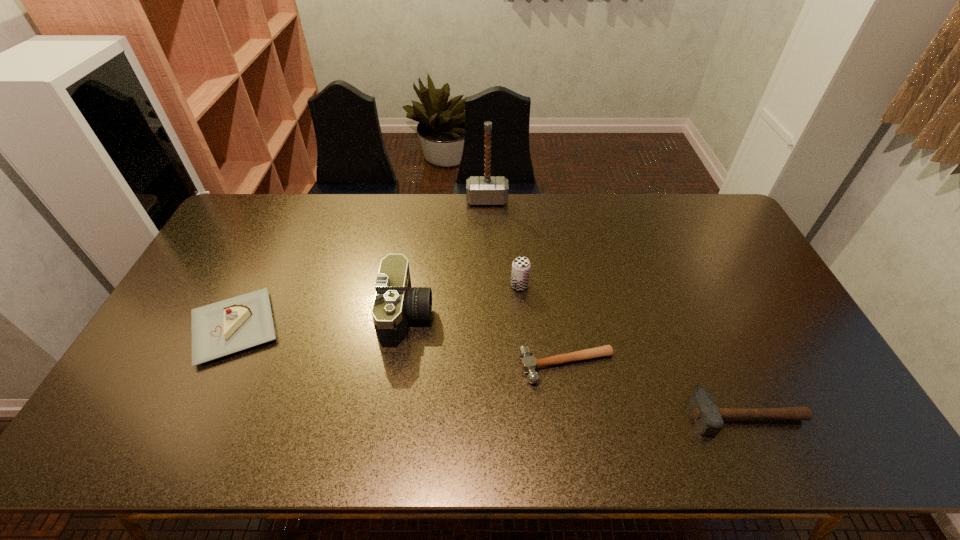
You are a GUI agent. You are given a task and a screenshot of the screen. Output one action in this format:
    pyautogui.click(x=<x>, y=<y>)
    Task: Click on the farthest hammer
    
    Given the screenshot: What is the action you would take?
    pyautogui.click(x=480, y=190)

Find the location of a particular element. Image resolution: width=960 pixels, height=540 pixels. the farthest object is located at coordinates (480, 190).

In order to click on the second tallest object in this screenshot , I will do `click(395, 302)`.

Locate an element on the screen. Image resolution: width=960 pixels, height=540 pixels. the fifth object from right to left is located at coordinates pyautogui.click(x=395, y=302).

Where is `the fourth shortest object`? the fourth shortest object is located at coordinates (521, 265).

In order to click on the leftmost object in this screenshot , I will do `click(235, 324)`.

What are the coordinates of `the fourth tallest object` in the screenshot? It's located at (235, 324).

At what (x,y) coordinates should I click in order to perform the action: click on the second shortest hammer. Please return your answer as a coordinate pair (x, y). Looking at the image, I should click on (708, 417).

Locate an element on the screen. the fifth tallest object is located at coordinates (708, 417).

The height and width of the screenshot is (540, 960). Find the location of `the second farthest hammer`. the second farthest hammer is located at coordinates (529, 363).